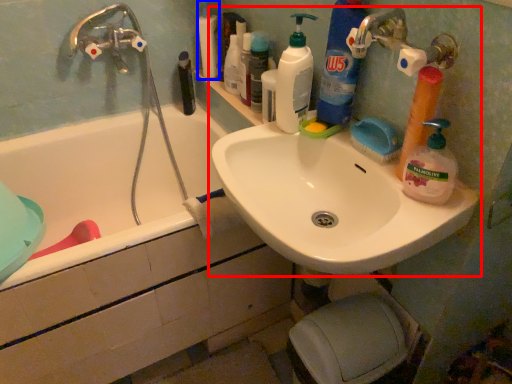
Question: Which object is closer to the camera taking this photo, sink (highlighted by a red box) or toiletry (highlighted by a blue box)?

Choices:
 (A) sink
 (B) toiletry

Answer: (A)